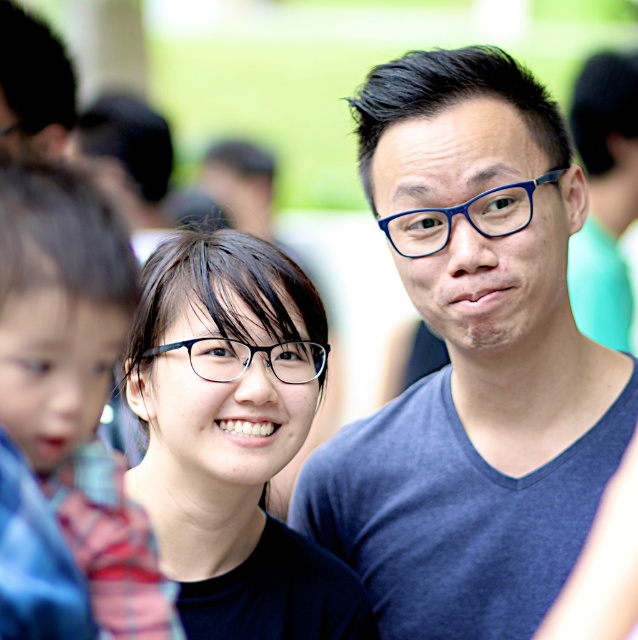
You are standing at the point with coordinates point (567, 464). You want to walk to the point with coordinates point (226, 364). Which direction should you move in to reach your destination?

To reach point (226, 364) from point (567, 464), you should move towards the upper left direction since point (567, 464) is behind point (226, 364).

You are a photographer at this event and want to capture a closeup of the plaid fabric shirt at left without including the other subjects. Based on its distance from the camera, can you do this using a standard zoom lens with a minimum focusing distance of 30 inches?

The plaid fabric shirt at left is 35.85 inches from the camera. Since the minimum focusing distance of the standard zoom lens is 30 inches, the photographer can focus on the plaid fabric shirt at left as it is beyond the minimum distance required.

You are a photographer at an event and need to adjust the lighting. You have a light source that can only reach up to 20 inches. The plaid fabric shirt at left and clear plastic glasses at center are in your frame. Can the light source effectively illuminate both objects without moving the light?

The plaid fabric shirt at left is 20.19 inches from the clear plastic glasses at center. Since the distance between them exceeds the light source range of 20 inches, the light source cannot effectively illuminate both objects simultaneously without moving the light.